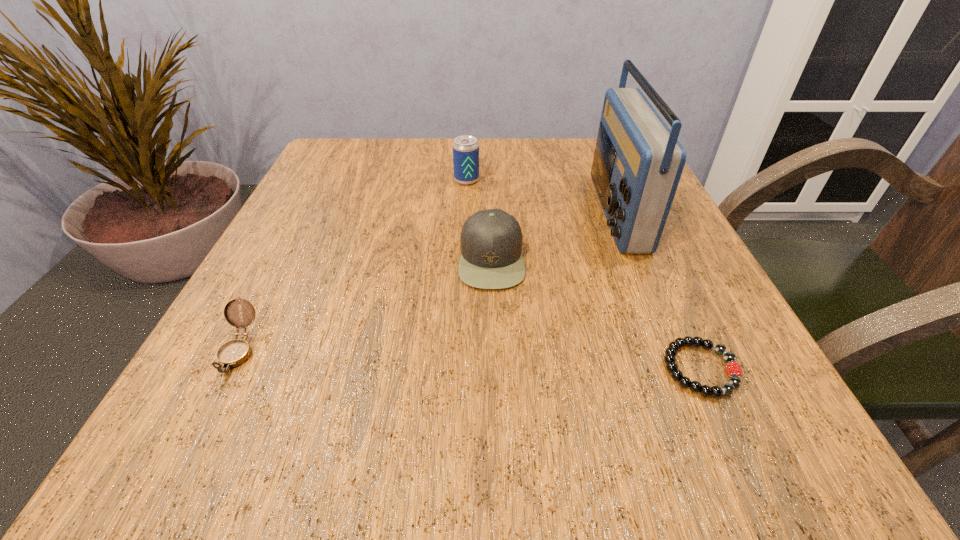
Where is `radio receiver`? The image size is (960, 540). radio receiver is located at coordinates (638, 161).

Identify the location of the second tallest object. (465, 148).

Locate an element on the screen. The height and width of the screenshot is (540, 960). cap is located at coordinates (491, 240).

This screenshot has height=540, width=960. What are the coordinates of `the second shortest object` in the screenshot? It's located at (234, 353).

This screenshot has width=960, height=540. Find the location of `compass`. compass is located at coordinates (234, 353).

Identify the location of bracelet. Image resolution: width=960 pixels, height=540 pixels. (734, 371).

This screenshot has width=960, height=540. What are the coordinates of `vacant area situated 0.090m on the front panel of the tallest object` in the screenshot? It's located at (550, 212).

I want to click on blank space located 0.380m on the front panel of the tallest object, so click(x=403, y=212).

The width and height of the screenshot is (960, 540). In order to click on free spot located 0.300m on the front panel of the tallest object in this screenshot , I will do `click(444, 212)`.

Image resolution: width=960 pixels, height=540 pixels. Identify the location of vacant space positioned 0.180m on the front of the beer can. (464, 237).